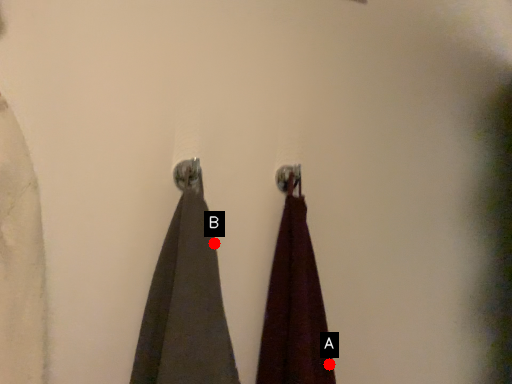
Question: Two points are circled on the image, labeled by A and B beside each circle. Which point is further to the camera?

Choices:
 (A) A is further
 (B) B is further

Answer: (A)